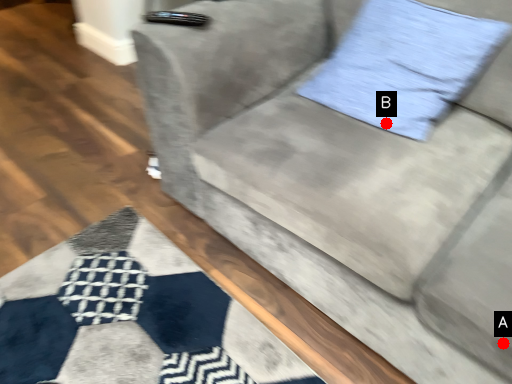
Question: Two points are circled on the image, labeled by A and B beside each circle. Which point is closer to the camera taking this photo?

Choices:
 (A) A is closer
 (B) B is closer

Answer: (A)